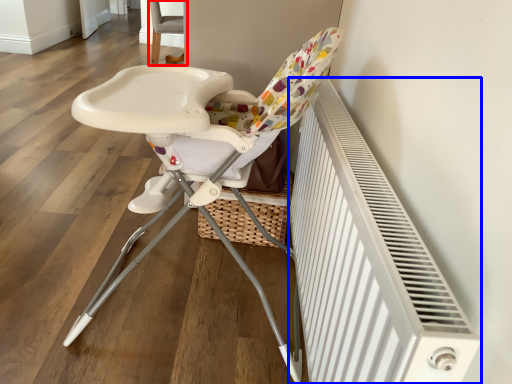
Question: Which of the following is the closest to the observer, chair (highlighted by a red box) or radiator (highlighted by a blue box)?

Choices:
 (A) chair
 (B) radiator

Answer: (B)